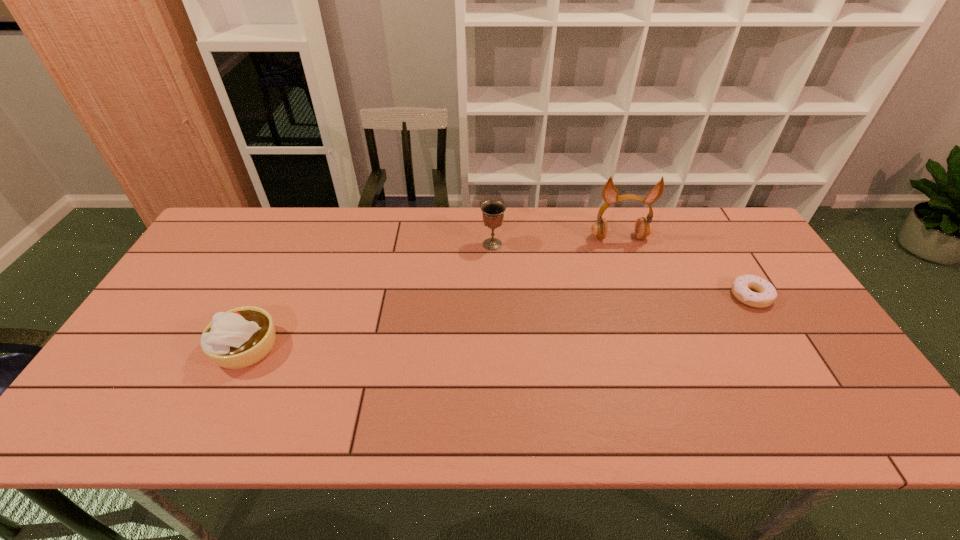
I want to click on vacant position located 0.130m on the front of the leftmost object, so click(210, 426).

The width and height of the screenshot is (960, 540). What are the coordinates of `vacant space located on the front of the second nearest object` in the screenshot? It's located at (815, 402).

Image resolution: width=960 pixels, height=540 pixels. I want to click on earphone that is at the far edge, so click(x=643, y=228).

Locate an element on the screen. The height and width of the screenshot is (540, 960). chalice that is at the far edge is located at coordinates (493, 211).

You are a GUI agent. You are given a task and a screenshot of the screen. Output one action in this format:
    pyautogui.click(x=<x>, y=<y>)
    Task: Click on the object that is at the right edge
    
    Given the screenshot: What is the action you would take?
    pyautogui.click(x=741, y=286)

Identify the location of vacant area at the far edge of the desktop. [x=378, y=225].

In the image, there is a desktop. Identify the location of vacant space at the near edge. (534, 420).

In the image, there is a desktop. Where is `vacant space at the left edge`? This screenshot has width=960, height=540. vacant space at the left edge is located at coordinates (156, 350).

Where is `blank space at the right edge of the desktop`? The width and height of the screenshot is (960, 540). blank space at the right edge of the desktop is located at coordinates (816, 369).

In the image, there is a desktop. Where is `vacant space at the far left corner`? vacant space at the far left corner is located at coordinates (199, 249).